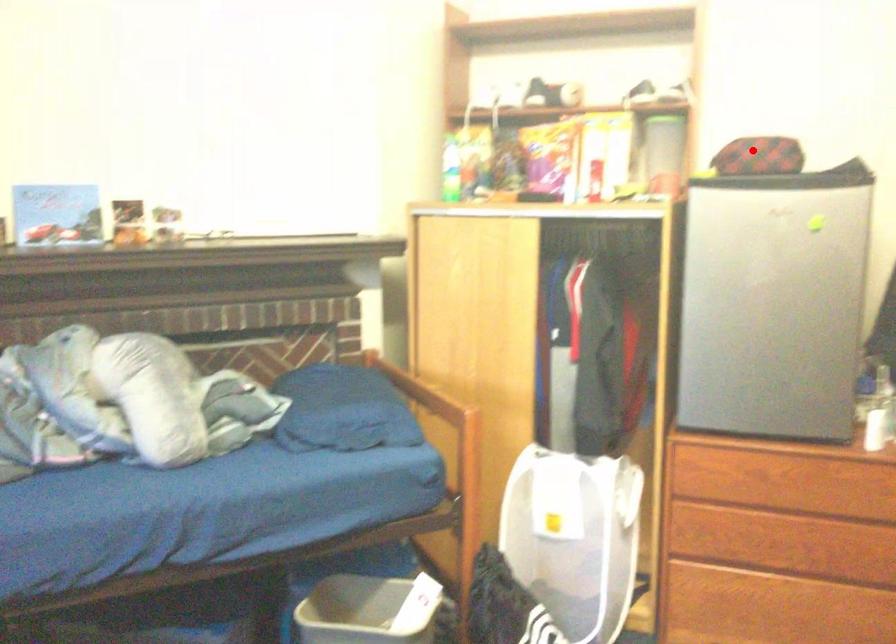
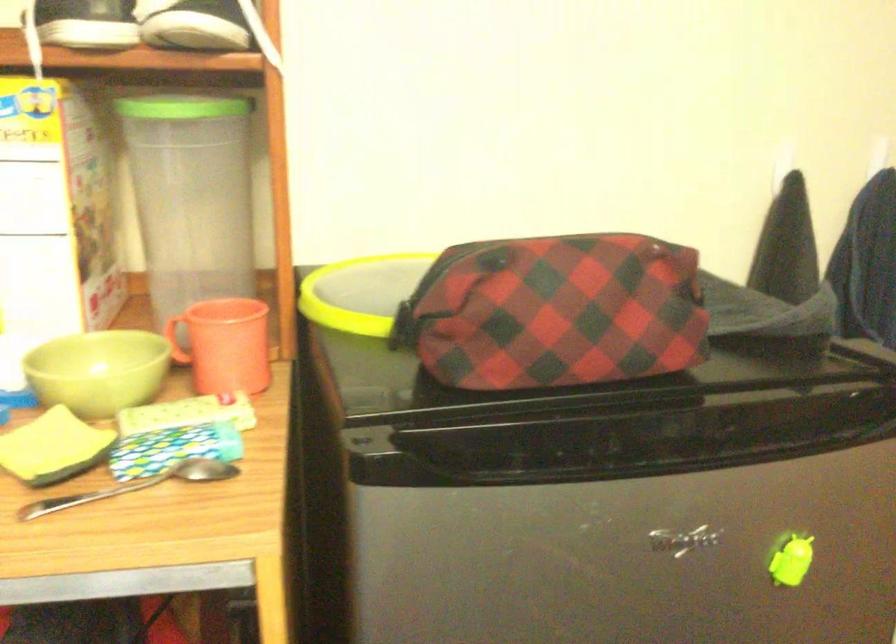
Question: I am providing you with two images of the same scene from different viewpoints. Image1 has a red point marked. In image2, the corresponding 3D location appears at what relative position? Reply with the corresponding letter.

Choices:
 (A) Closer
 (B) Farther

Answer: (A)